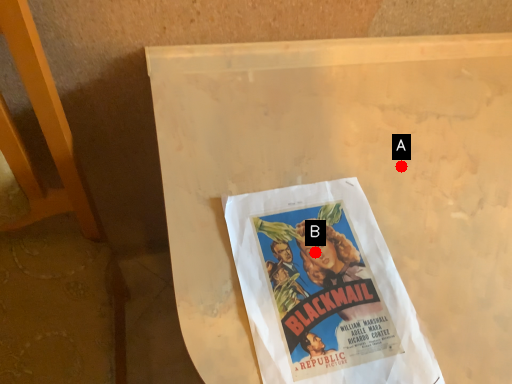
Question: Two points are circled on the image, labeled by A and B beside each circle. Which point is closer to the camera taking this photo?

Choices:
 (A) A is closer
 (B) B is closer

Answer: (B)